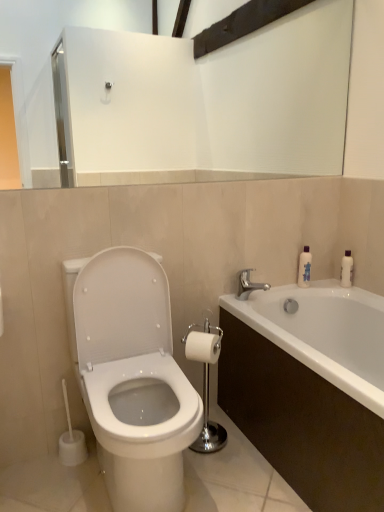
The image size is (384, 512). In order to click on free spot to the right of translucent plastic bottle at upper right in this screenshot , I will do `click(326, 284)`.